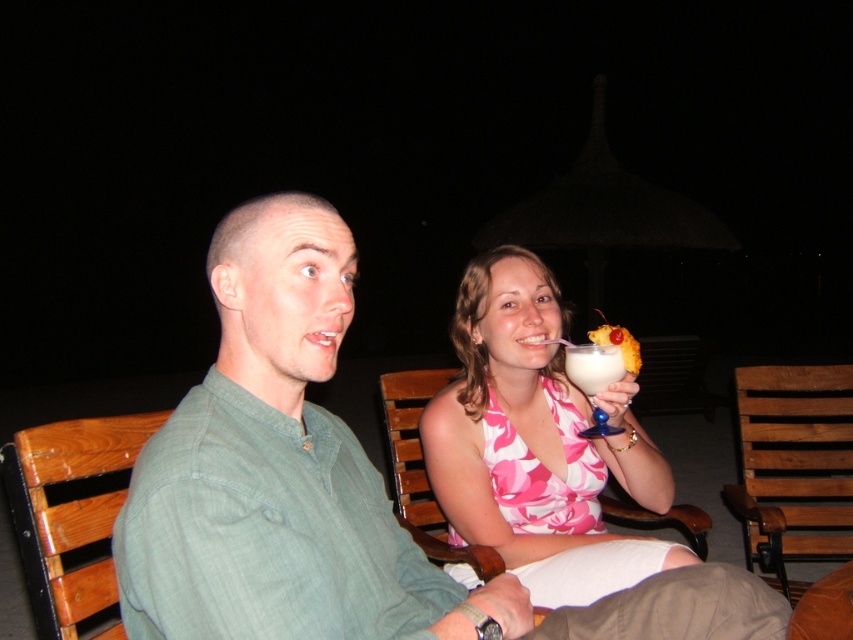
Question: Does pink floral dress at center appear under white frothy drink at upper center?

Choices:
 (A) yes
 (B) no

Answer: (A)

Question: Is the position of green matte shirt at center more distant than that of pink floral dress at center?

Choices:
 (A) no
 (B) yes

Answer: (A)

Question: Does green matte shirt at center lie behind white creamy drink at upper center?

Choices:
 (A) yes
 (B) no

Answer: (B)

Question: Which object is closer to the camera taking this photo?

Choices:
 (A) green matte shirt at center
 (B) white frothy drink at upper center

Answer: (A)

Question: Based on their relative distances, which object is nearer to the white frothy drink at upper center?

Choices:
 (A) white creamy drink at upper center
 (B) green matte shirt at center

Answer: (A)

Question: Which object is farther from the camera taking this photo?

Choices:
 (A) green matte shirt at center
 (B) pink floral dress at center
 (C) white frothy drink at upper center
 (D) white creamy drink at upper center

Answer: (C)